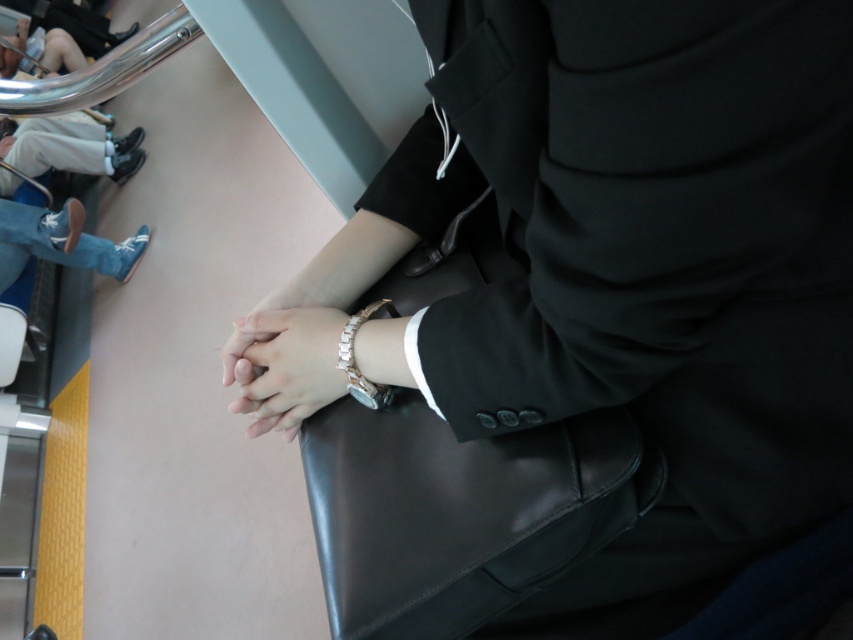
Does black matte suit at center appear under satin silver watch at center?

Yes.

Which is behind, point (758, 33) or point (241, 326)?

Positioned behind is point (241, 326).

Does point (660, 378) come in front of point (270, 358)?

Yes, point (660, 378) is closer to viewer.

This screenshot has width=853, height=640. I want to click on black matte suit at center, so click(590, 314).